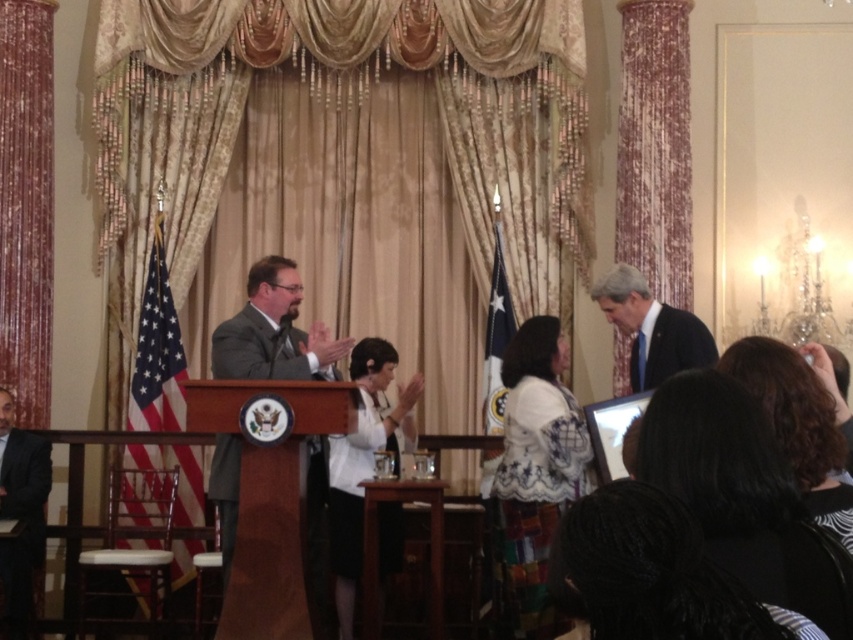
You are standing in the ceremonial event venue and want to locate the gold fabric curtain at center. According to the coordinates provided, where should you look?

The gold fabric curtain at center is located at coordinates point (347,104).

Consider the image. You are a photographer at this event and need to capture a clear shot of the black suit at lower left without the gold fabric curtain at center blocking the view. Is this possible given their positions?

The gold fabric curtain at center is in front of the black suit at lower left, so it would block the view. To capture the black suit at lower left clearly, you would need to move to a position where the curtain is not between you and the subject.